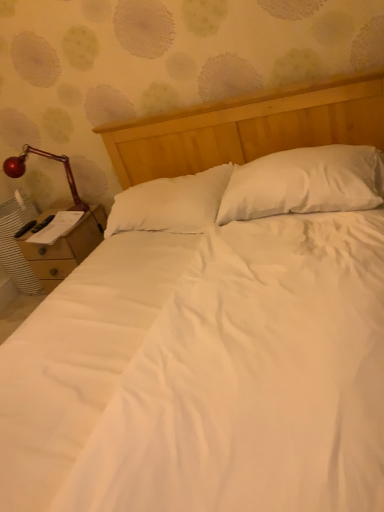
Question: From the image's perspective, is white soft pillow at center, the first pillow in the right-to-left sequence, above or below shiny red lamp at left?

Choices:
 (A) below
 (B) above

Answer: (A)

Question: Is point (292, 167) positioned closer to the camera than point (13, 160)?

Choices:
 (A) closer
 (B) farther

Answer: (A)

Question: Which is nearer to the white soft pillow at center, the first pillow in the right-to-left sequence?

Choices:
 (A) shiny red lamp at left
 (B) wooden nightstand at left
 (C) white soft pillow at center, the first pillow in the left-to-right sequence

Answer: (C)

Question: Which of these objects is positioned closest to the wooden nightstand at left?

Choices:
 (A) shiny red lamp at left
 (B) white soft pillow at center, the first pillow in the right-to-left sequence
 (C) white soft pillow at center, the first pillow in the left-to-right sequence

Answer: (A)